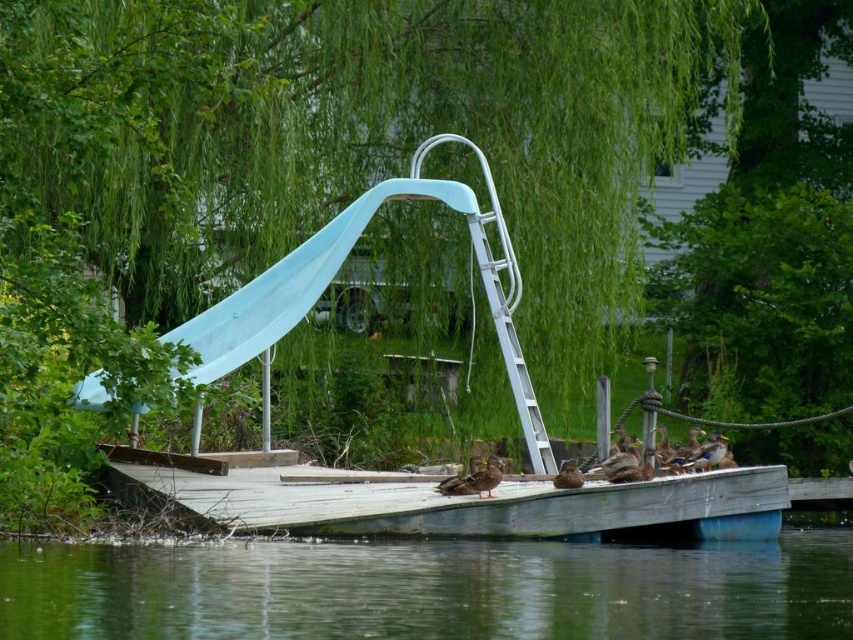
Question: Is green water at lower center positioned at the back of blue rubber slide at upper center?

Choices:
 (A) yes
 (B) no

Answer: (B)

Question: Among these points, which one is nearest to the camera?

Choices:
 (A) (369, 189)
 (B) (718, 508)
 (C) (820, 563)

Answer: (C)

Question: Among these objects, which one is farthest from the camera?

Choices:
 (A) wooden dock at lower center
 (B) blue rubber slide at upper center
 (C) green leafy willow at upper center
 (D) green water at lower center

Answer: (B)

Question: Can you confirm if green leafy willow at upper center is positioned to the left of green water at lower center?

Choices:
 (A) no
 (B) yes

Answer: (B)

Question: In this image, where is wooden dock at lower center located relative to blue rubber slide at upper center?

Choices:
 (A) below
 (B) above

Answer: (A)

Question: Which point appears farthest from the camera in this image?

Choices:
 (A) (664, 538)
 (B) (604, 618)
 (C) (184, 332)

Answer: (C)